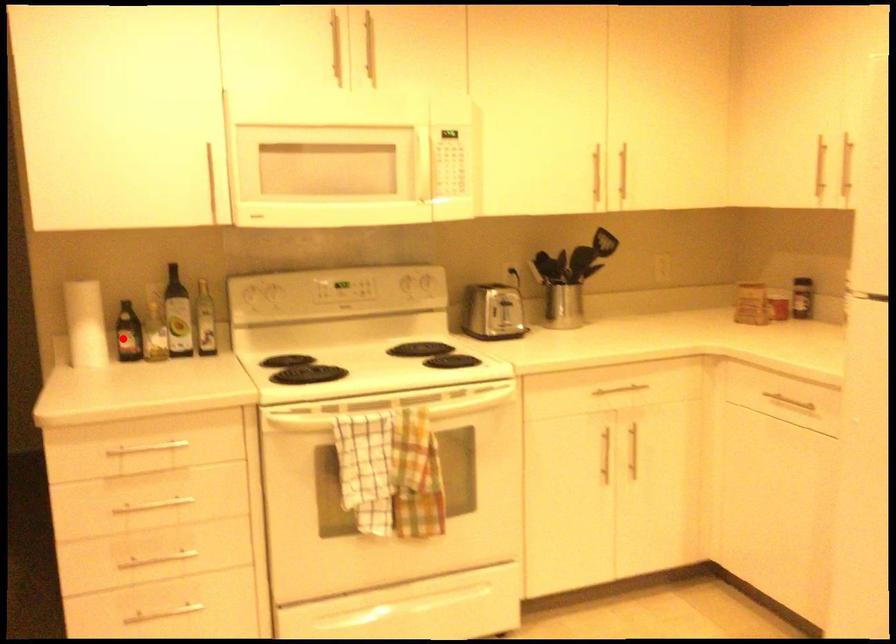
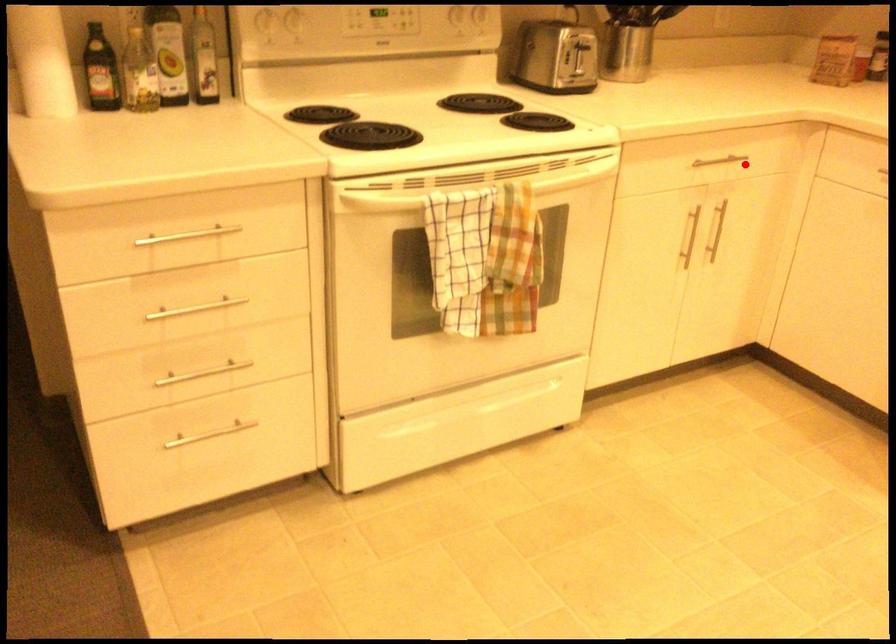
I am providing you with two images of the same scene from different viewpoints. A red point is marked on the first image and another point is marked on the second image. Is the marked point in image1 the same physical position as the marked point in image2?

No